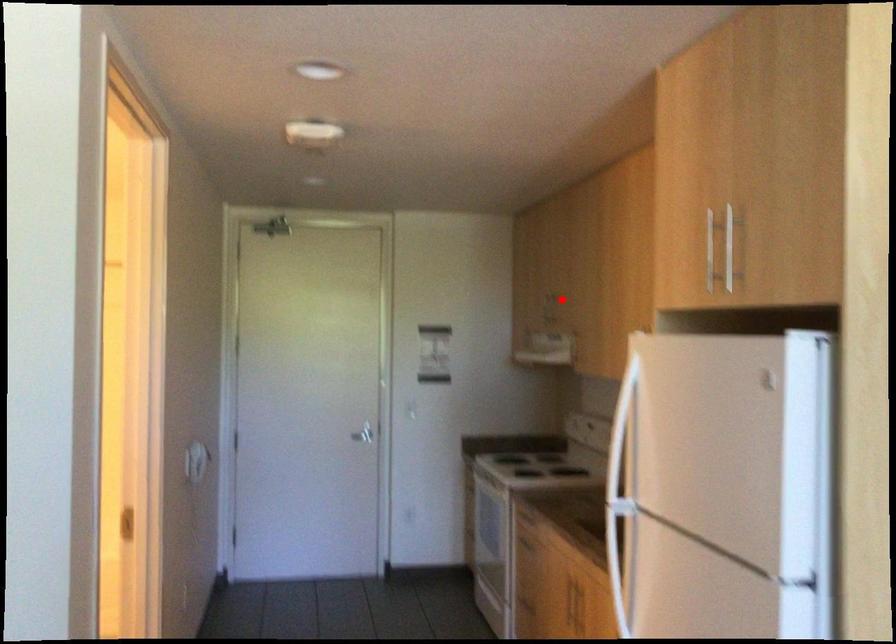
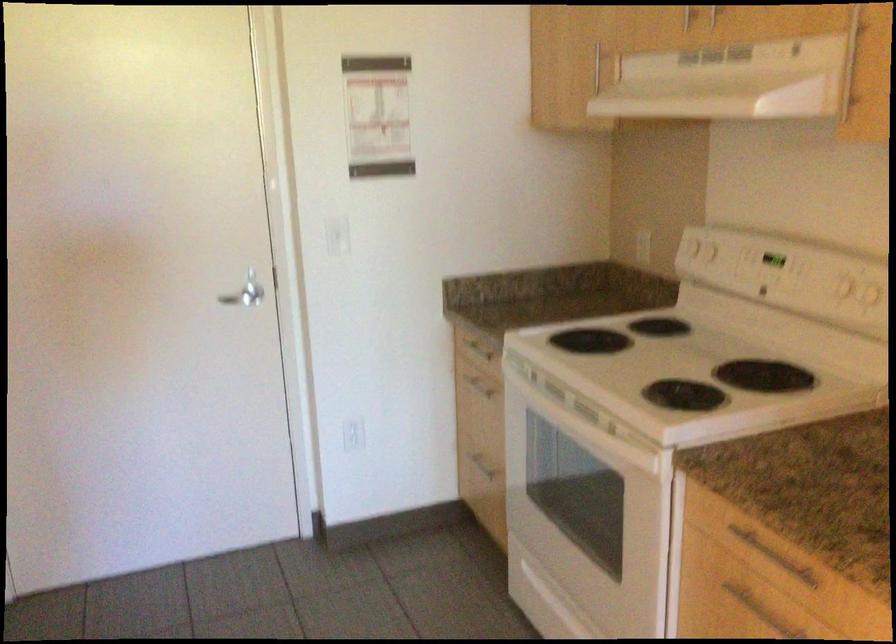
Question: I am providing you with two images of the same scene from different viewpoints. Image1 has a red point marked. In image2, the corresponding 3D location appears at what relative position? Reply with the corresponding letter.

Choices:
 (A) Closer
 (B) Farther

Answer: (A)